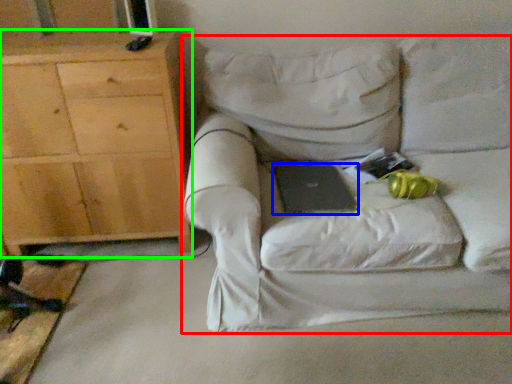
Question: Which object is positioned farthest from chair (highlighted by a red box)? Select from laptop (highlighted by a blue box) and cabinetry (highlighted by a green box).

Choices:
 (A) laptop
 (B) cabinetry

Answer: (B)